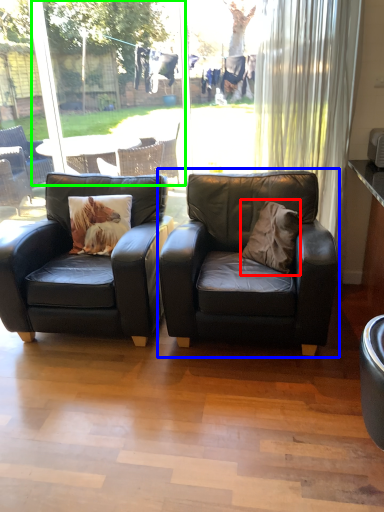
Question: Which is nearer to the throw pillow (highlighted by a red box)? chair (highlighted by a blue box) or window screen (highlighted by a green box).

Choices:
 (A) chair
 (B) window screen

Answer: (A)